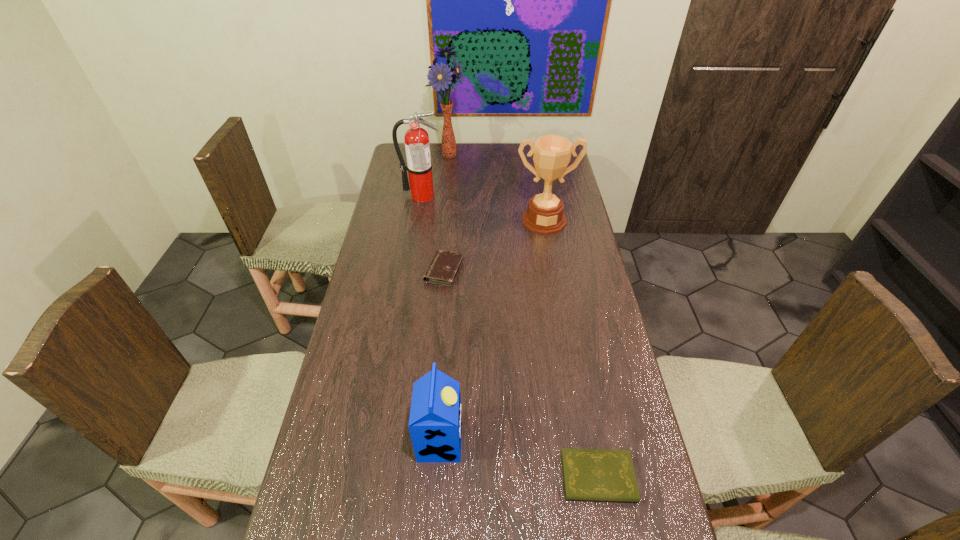
At what (x,y) coordinates should I click in order to perform the action: click on free space that is in between the farthest object and the carton. Please return your answer as a coordinate pair (x, y). The image size is (960, 540). Looking at the image, I should click on (444, 298).

At what (x,y) coordinates should I click in order to perform the action: click on free space between the tallest object and the second farthest object. Please return your answer as a coordinate pair (x, y). This screenshot has width=960, height=540. Looking at the image, I should click on (435, 175).

This screenshot has height=540, width=960. I want to click on object that can be found as the second closest to the nearer diary, so click(x=443, y=269).

At what (x,y) coordinates should I click in order to perform the action: click on the closest object relative to the farthest object. Please return your answer as a coordinate pair (x, y). Looking at the image, I should click on (417, 146).

You are a GUI agent. You are given a task and a screenshot of the screen. Output one action in this format:
    pyautogui.click(x=<x>, y=<y>)
    Task: Click on the blank space that satisfies the following two spatial constraints: 1. on the nozzle side of the fifth nearest object; 2. on the right side of the shortest object
    Image resolution: width=960 pixels, height=540 pixels.
    Given the screenshot: What is the action you would take?
    pyautogui.click(x=376, y=477)

Where is `vacant space that satisfies the following two spatial constraints: 1. on the front-facing side of the award; 2. with the cap open on the third shortest object`? The height and width of the screenshot is (540, 960). vacant space that satisfies the following two spatial constraints: 1. on the front-facing side of the award; 2. with the cap open on the third shortest object is located at coordinates (581, 441).

Image resolution: width=960 pixels, height=540 pixels. What are the coordinates of `free region that satisfies the following two spatial constraints: 1. with the cap open on the carton; 2. on the back side of the nearer diary` in the screenshot? It's located at (438, 477).

This screenshot has height=540, width=960. I want to click on vacant space that satisfies the following two spatial constraints: 1. on the nozzle side of the fire extinguisher; 2. on the right side of the farther diary, so click(x=410, y=271).

Find the location of a particular element. Image resolution: width=960 pixels, height=540 pixels. vacant area in the image that satisfies the following two spatial constraints: 1. on the nozzle side of the farther diary; 2. on the right side of the fire extinguisher is located at coordinates (410, 271).